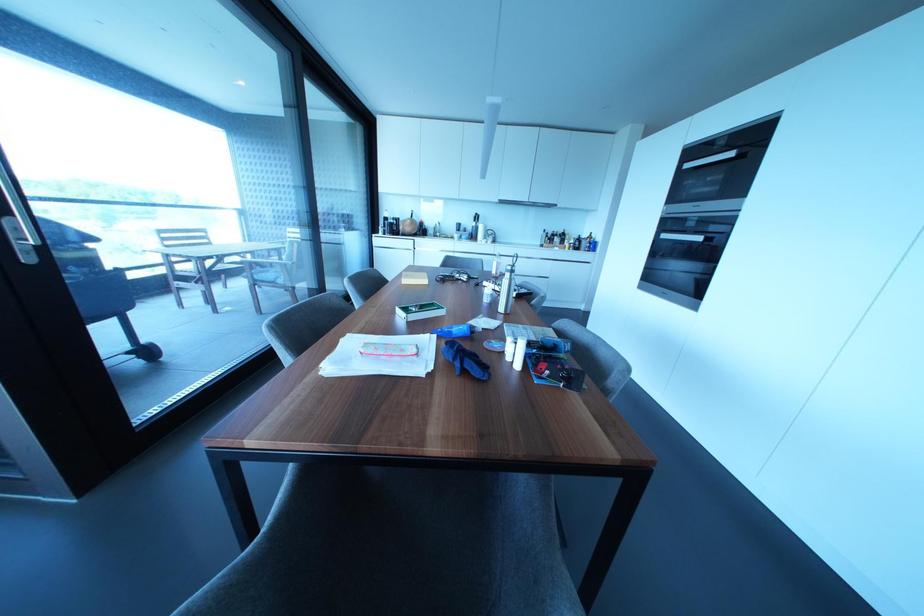
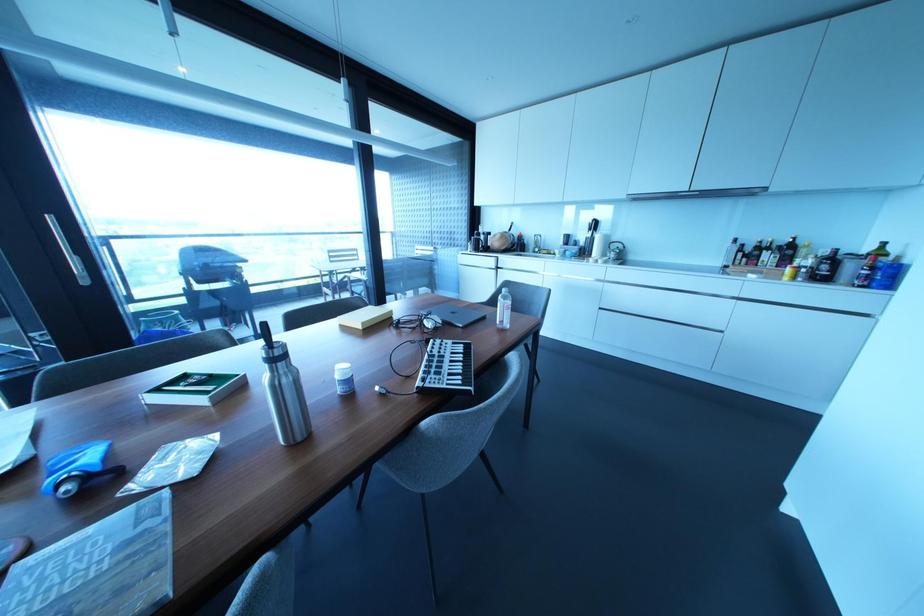
Find the pixel in the second image that matches point 489,232 in the first image.

(614, 245)